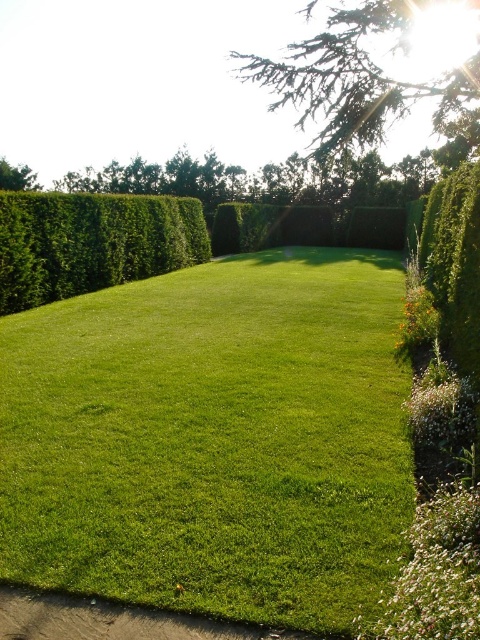
You are standing in the garden and want to walk towards the green leafy hedge at left. Which direction should you move relative to the green grassy at center?

Since the green grassy at center is closer to you than the green leafy hedge at left, you should move forward away from the green grassy at center towards the green leafy hedge at left.

You are standing at the center of the lawn in the garden scene. There is a point marked at coordinates point (92, 243). Which object is located at that point?

The point (92, 243) corresponds to the green leafy hedge at left.

You are standing in the garden and want to walk from the green leafy hedge at left to the green grassy at center. Which direction should you move to reach the destination?

The green grassy at center is below the green leafy hedge at left, so you should move downward to reach the green grassy at center from the green leafy hedge at left.